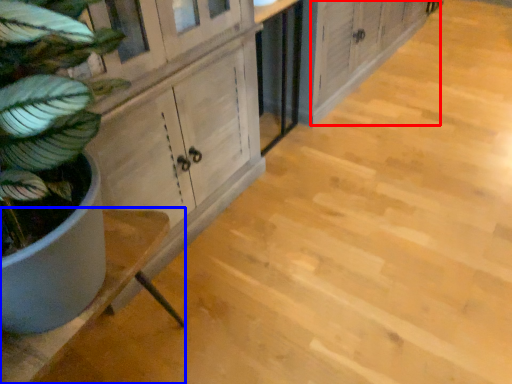
Question: Among these objects, which one is nearest to the camera, cabinetry (highlighted by a red box) or counter (highlighted by a blue box)?

Choices:
 (A) cabinetry
 (B) counter

Answer: (B)